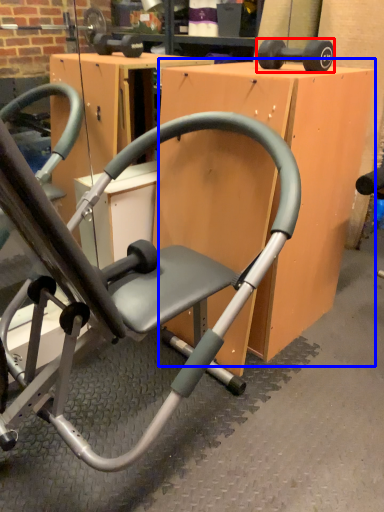
Question: Which object appears farthest to the camera in this image, dumbbell (highlighted by a red box) or table (highlighted by a blue box)?

Choices:
 (A) dumbbell
 (B) table

Answer: (A)